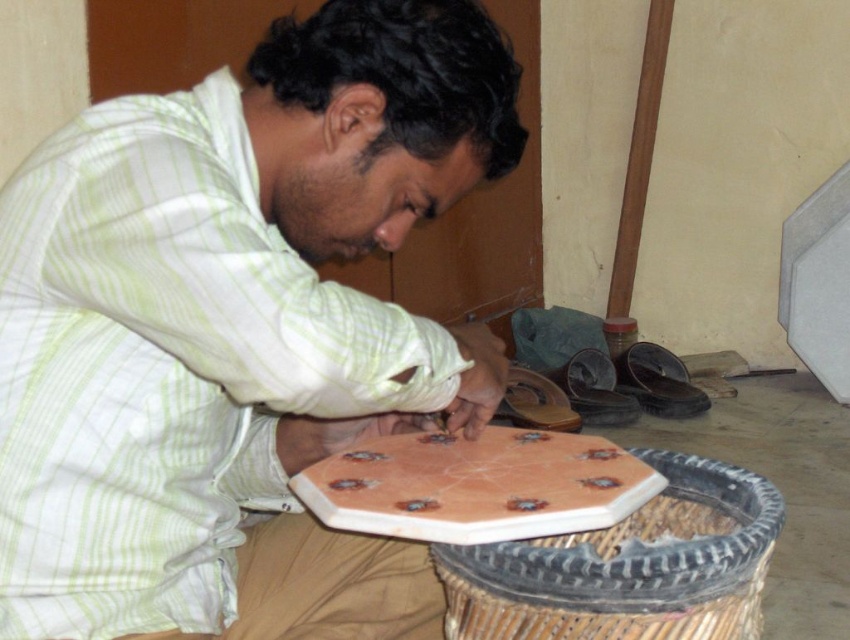
You are a delivery person who needs to place a small package between the white striped shirt at center and the black rubber shoe at lower center. The package is 6 feet long. Can you fit it between them without moving either object?

The distance between the white striped shirt at center and the black rubber shoe at lower center is 6.23 feet. Since the package is 6 feet long, it can fit between them as the available space is slightly larger than the package.

You are a 3D modeler trying to reconstruct the octagonal object in the scene. You have two points marked on it, point (140, 474) and point (582, 422). Which point is closer to you when viewing the object from the front?

Point (140, 474) is closer to the viewer than point (582, 422).